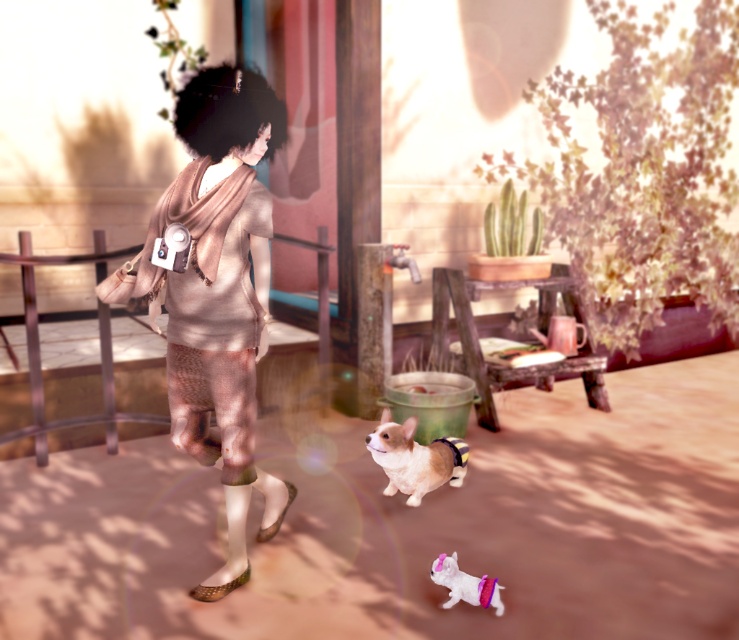
Question: In this image, where is soft beige fur at center located relative to white fabric dog at lower center?

Choices:
 (A) above
 (B) below

Answer: (A)

Question: Which point is closer to the camera?

Choices:
 (A) matte beige dress at center
 (B) white fabric dog at lower center
 (C) soft beige fur at center

Answer: (A)

Question: Which of the following is the farthest from the observer?

Choices:
 (A) (423, 460)
 (B) (234, 96)

Answer: (A)

Question: Which object is positioned closest to the white fabric dog at lower center?

Choices:
 (A) soft beige fur at center
 (B) matte beige dress at center

Answer: (A)

Question: Is matte beige dress at center thinner than white fabric dog at lower center?

Choices:
 (A) no
 (B) yes

Answer: (A)

Question: Does soft beige fur at center appear under white fabric dog at lower center?

Choices:
 (A) no
 (B) yes

Answer: (A)